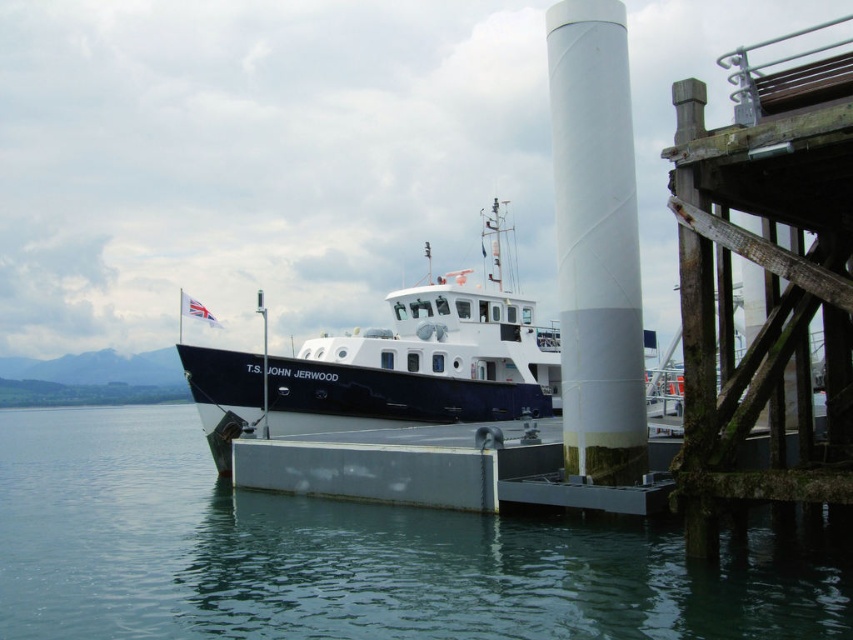
Question: Observing the image, what is the correct spatial positioning of clear water at lower center in reference to white textured pipe at center?

Choices:
 (A) above
 (B) below

Answer: (B)

Question: Is clear water at lower center above white glossy boat at center?

Choices:
 (A) yes
 (B) no

Answer: (B)

Question: Among these objects, which one is nearest to the camera?

Choices:
 (A) white textured pipe at center
 (B) clear water at lower center
 (C) white glossy boat at center

Answer: (B)

Question: Can you confirm if clear water at lower center is wider than white glossy boat at center?

Choices:
 (A) yes
 (B) no

Answer: (A)

Question: Among these points, which one is farthest from the camera?

Choices:
 (A) (154, 611)
 (B) (389, 419)

Answer: (B)

Question: Among these objects, which one is farthest from the camera?

Choices:
 (A) white glossy boat at center
 (B) white textured pipe at center
 (C) clear water at lower center

Answer: (A)